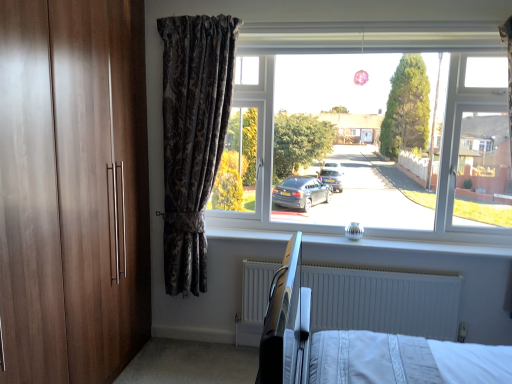
You are a GUI agent. You are given a task and a screenshot of the screen. Output one action in this format:
    pyautogui.click(x=<x>, y=<y>)
    Task: Click on the vacant space situated above silver metallic knob at center (from a real-world perspective)
    The width and height of the screenshot is (512, 384).
    Given the screenshot: What is the action you would take?
    pyautogui.click(x=400, y=245)